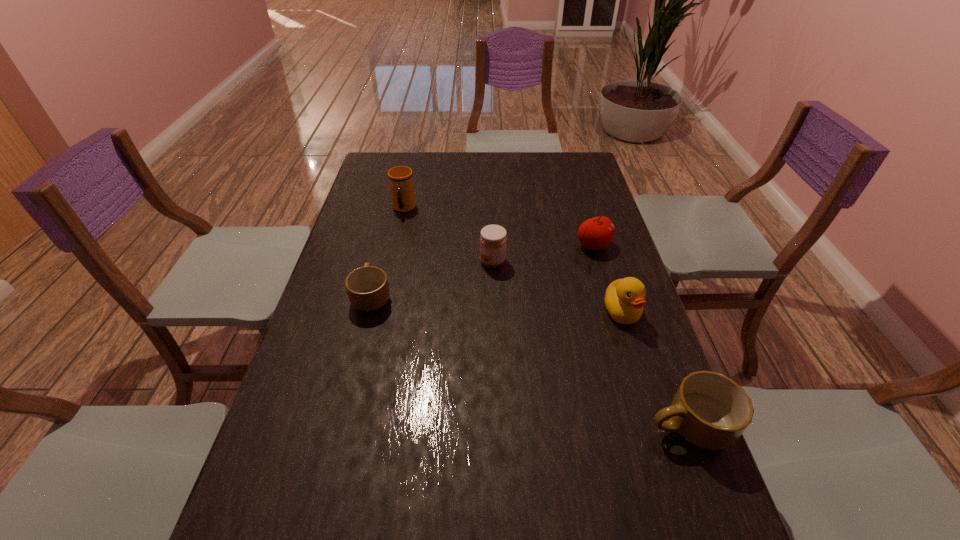
In order to click on the shorter mug in this screenshot , I will do `click(367, 287)`.

Where is `the left mug`? the left mug is located at coordinates (367, 287).

The height and width of the screenshot is (540, 960). In order to click on the taller mug in this screenshot , I will do `click(711, 411)`.

This screenshot has width=960, height=540. Identify the location of the right mug. (711, 411).

At what (x,y) coordinates should I click in order to perform the action: click on the farthest object. Please return your answer as a coordinate pair (x, y). Looking at the image, I should click on (401, 184).

Find the location of a particular element. Image resolution: width=960 pixels, height=540 pixels. apple is located at coordinates (596, 233).

At what (x,y) coordinates should I click in order to perform the action: click on duck. Please return your answer as a coordinate pair (x, y). Looking at the image, I should click on (624, 299).

Locate an element on the screen. the fourth object from right to left is located at coordinates (493, 241).

Locate an element on the screen. vacant space positioned 0.250m on the side with the handle of the shorter mug is located at coordinates (390, 228).

The image size is (960, 540). Identify the location of free space located on the side with the handle of the shorter mug. (385, 245).